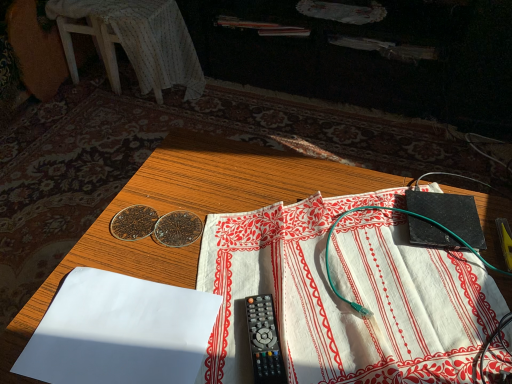
Question: Can you confirm if wooden table at center is bigger than white cloth at center, which is counted as the second sheet, starting from the left?

Choices:
 (A) yes
 (B) no

Answer: (A)

Question: Considering the relative sizes of wooden table at center and white cloth at center, which is counted as the second sheet, starting from the left, in the image provided, is wooden table at center smaller than white cloth at center, which is counted as the second sheet, starting from the left,?

Choices:
 (A) yes
 (B) no

Answer: (B)

Question: Can you confirm if wooden table at center is shorter than white cloth at center, acting as the 1th sheet starting from the right?

Choices:
 (A) yes
 (B) no

Answer: (B)

Question: Is wooden table at center beside white cloth at center, which is counted as the second sheet, starting from the left?

Choices:
 (A) no
 (B) yes

Answer: (A)

Question: From a real-world perspective, does wooden table at center stand above white cloth at center, which is counted as the second sheet, starting from the left?

Choices:
 (A) yes
 (B) no

Answer: (B)

Question: Is point (259, 336) closer or farther from the camera than point (452, 314)?

Choices:
 (A) closer
 (B) farther

Answer: (A)

Question: Relative to white cloth at center, acting as the 1th sheet starting from the right, is black plastic remote control at center in front or behind?

Choices:
 (A) front
 (B) behind

Answer: (B)

Question: From a real-world perspective, is black plastic remote control at center physically located above or below white cloth at center, acting as the 1th sheet starting from the right?

Choices:
 (A) above
 (B) below

Answer: (B)

Question: From their relative heights in the image, would you say black plastic remote control at center is taller or shorter than white cloth at center, which is counted as the second sheet, starting from the left?

Choices:
 (A) tall
 (B) short

Answer: (B)

Question: From the image's perspective, is white cloth at center, acting as the 1th sheet starting from the right, above or below white fabric-covered stool at upper left?

Choices:
 (A) above
 (B) below

Answer: (B)

Question: Would you say white cloth at center, acting as the 1th sheet starting from the right, is to the left or to the right of white fabric-covered stool at upper left in the picture?

Choices:
 (A) left
 (B) right

Answer: (B)

Question: Based on their sizes in the image, would you say white cloth at center, which is counted as the second sheet, starting from the left, is bigger or smaller than white fabric-covered stool at upper left?

Choices:
 (A) big
 (B) small

Answer: (B)

Question: Relative to white fabric-covered stool at upper left, is white cloth at center, acting as the 1th sheet starting from the right, in front or behind?

Choices:
 (A) behind
 (B) front

Answer: (B)

Question: In the image, is white fabric-covered stool at upper left on the left side or the right side of white cloth at center, which is counted as the second sheet, starting from the left?

Choices:
 (A) right
 (B) left

Answer: (B)

Question: From a real-world perspective, is white fabric-covered stool at upper left positioned above or below white cloth at center, acting as the 1th sheet starting from the right?

Choices:
 (A) above
 (B) below

Answer: (B)